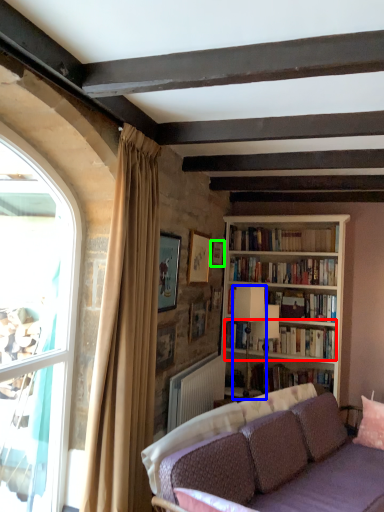
Question: Estimate the real-world distances between objects in this image. Which object is farther from book (highlighted by a red box), lamp (highlighted by a blue box) or picture frame (highlighted by a green box)?

Choices:
 (A) lamp
 (B) picture frame

Answer: (B)